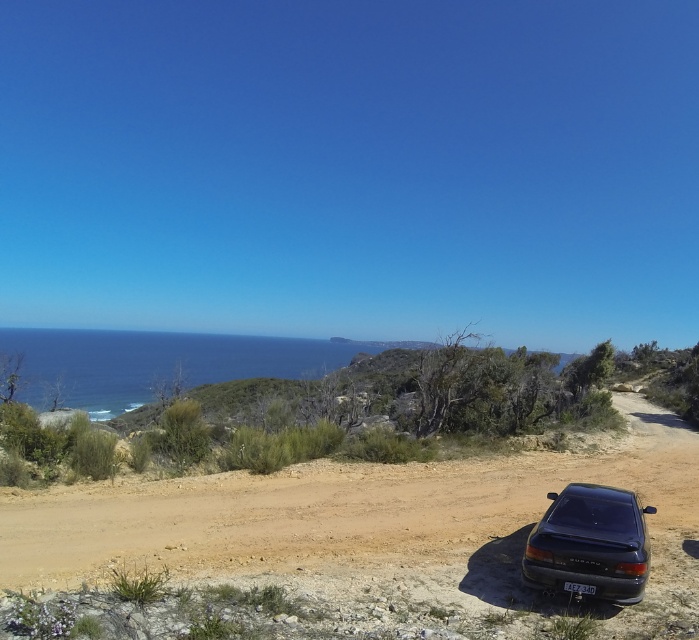
Based on the photo, you are a photographer standing on the dirt road and want to take a photo of the glossy black car at lower right and the black plastic license plate at lower center. Which object should you focus on first to ensure both are in sharp focus?

The glossy black car at lower right is closer to the viewer than the black plastic license plate at lower center, so you should focus on the glossy black car at lower right first to ensure both are in sharp focus.

You are driving a car and want to park on the brown dirt track at center. The glossy black car at lower right is already parked there. Can you park your car next to it without overlapping?

The brown dirt track at center is larger in size than the glossy black car at lower right, so there should be enough space to park your car next to it without overlapping.

Consider the image. You are a hiker standing on the brown dirt track at center and looking at the black plastic license plate at lower center. Is the license plate above or below you?

The brown dirt track at center is below the black plastic license plate at lower center, so the license plate is above you.